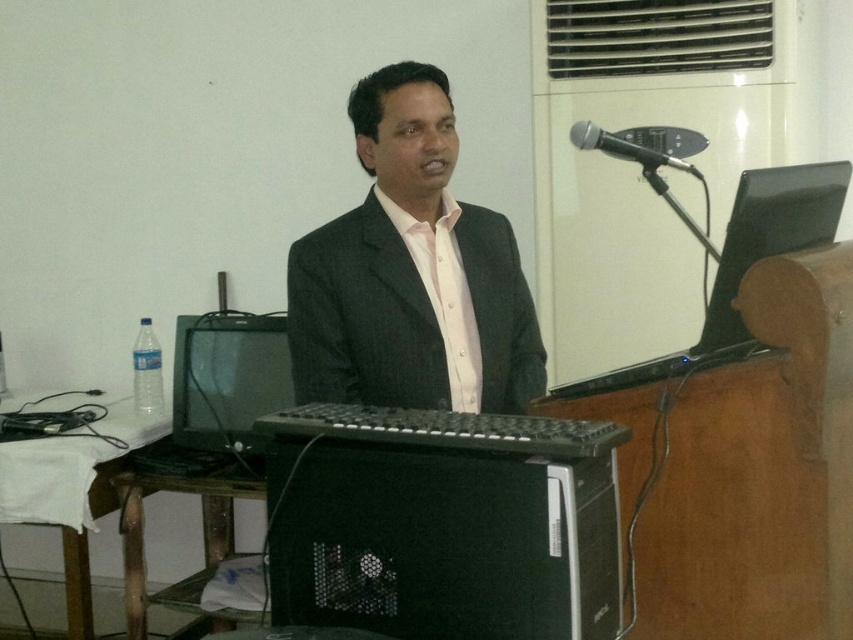
Question: Can you confirm if matte black suit at center is positioned to the left of black plastic monitor at upper right?

Choices:
 (A) no
 (B) yes

Answer: (B)

Question: Based on their relative distances, which object is nearer to the black metallic microphone at upper right?

Choices:
 (A) black plastic monitor at upper right
 (B) matte black suit at center

Answer: (A)

Question: Does black plastic monitor at upper right appear on the left side of black metallic microphone at upper right?

Choices:
 (A) yes
 (B) no

Answer: (B)

Question: Where is matte black suit at center located in relation to black metallic microphone at upper right in the image?

Choices:
 (A) right
 (B) left

Answer: (B)

Question: Considering the real-world distances, which object is farthest from the matte black suit at center?

Choices:
 (A) black plastic monitor at upper right
 (B) black metallic microphone at upper right

Answer: (A)

Question: Which of the following is the farthest from the observer?

Choices:
 (A) black metallic microphone at upper right
 (B) matte black suit at center

Answer: (B)